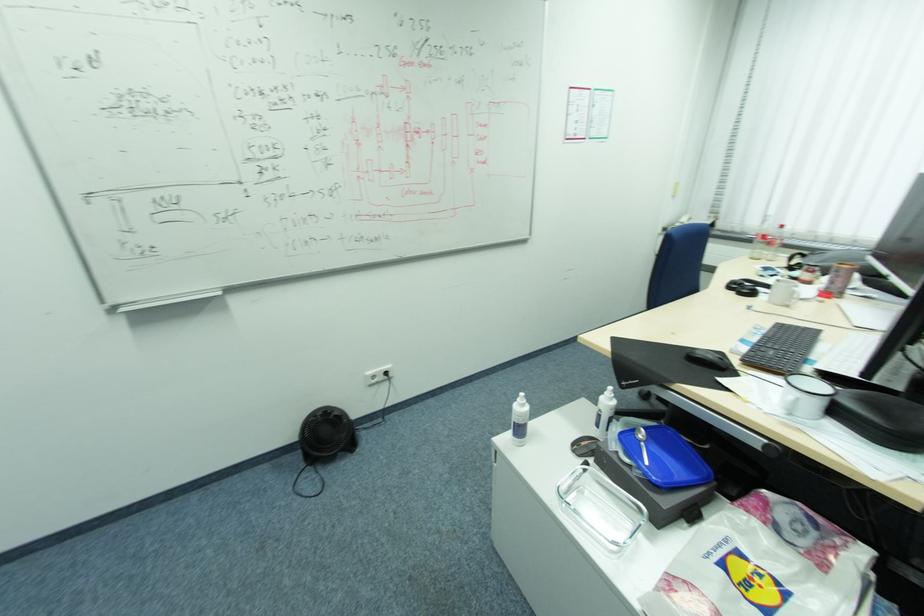
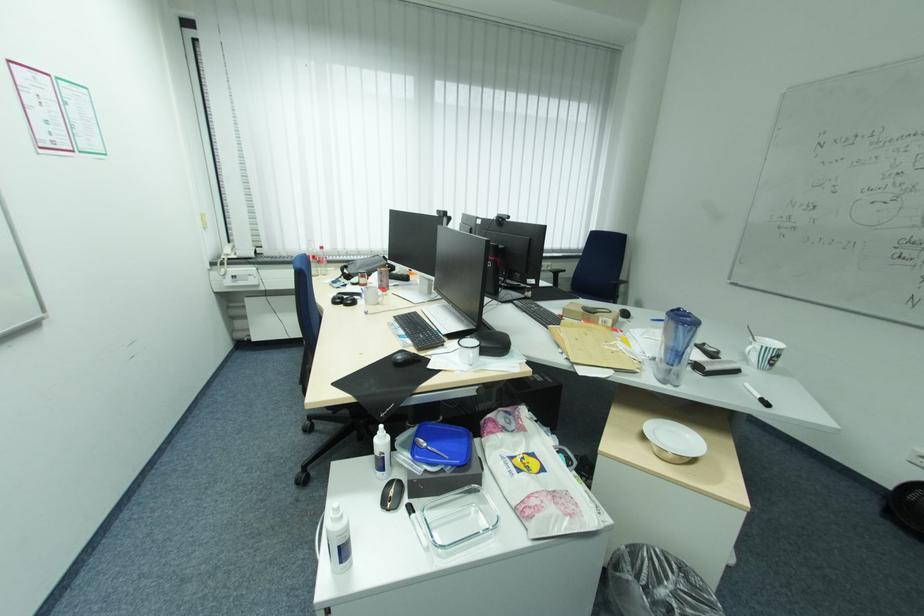
The point at (699, 355) is marked in the first image. Where is the corresponding point in the second image?

(406, 361)